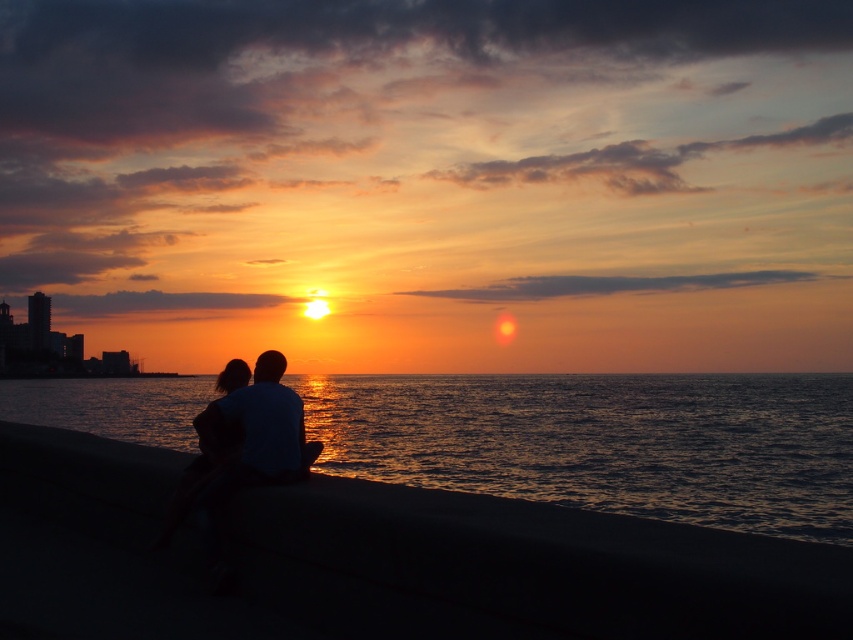
You are a photographer trying to capture the sunset scene. You notice the smooth concrete wall at lower center and the shiny dark water at lower center. Which object takes up more area in the image?

The shiny dark water at lower center occupies more space than the smooth concrete wall at lower center, so it takes up more area in the image.

You are a photographer planning to take a sunset photo of the smooth concrete wall at lower center. If you want to place the wall exactly at the center of the photo, how should you adjust your camera position?

The smooth concrete wall at lower center is currently located at point [378,561]. To center it, move the camera so that the wall aligns with the photo frame center at [426,320].